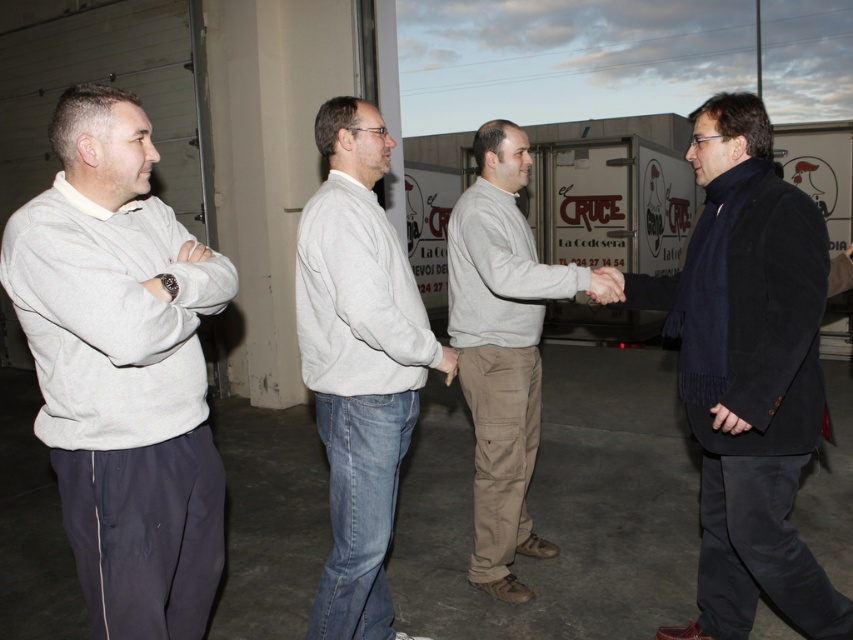
You are standing at the point marked as point (122, 369) in the image. What object is located at this point?

The light gray sweatshirt at left is located at point (122, 369).